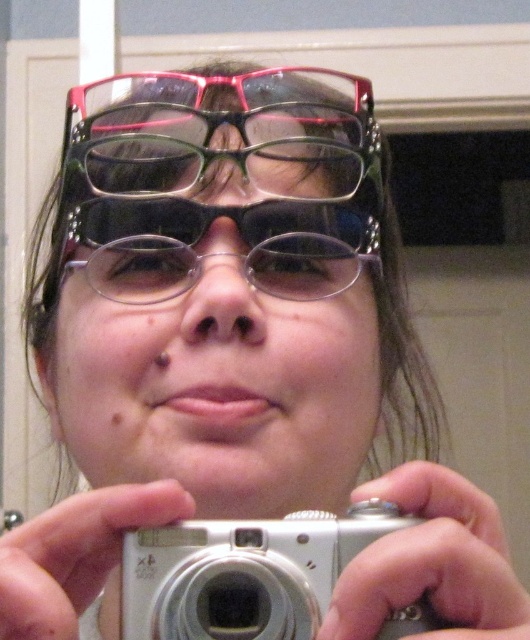
Question: Can you confirm if transparent plastic glasses at center is wider than silver metallic camera at center?

Choices:
 (A) no
 (B) yes

Answer: (B)

Question: Which of the following is the farthest from the observer?

Choices:
 (A) (360, 83)
 (B) (340, 560)

Answer: (A)

Question: Which point is farther to the camera?

Choices:
 (A) (242, 97)
 (B) (155, 612)

Answer: (A)

Question: Which object appears closest to the camera in this image?

Choices:
 (A) silver metallic camera at center
 (B) transparent plastic glasses at center

Answer: (A)

Question: Is transparent plastic glasses at center to the right of silver metallic camera at center from the viewer's perspective?

Choices:
 (A) no
 (B) yes

Answer: (A)

Question: Can you confirm if transparent plastic glasses at center is thinner than silver metallic camera at center?

Choices:
 (A) no
 (B) yes

Answer: (A)